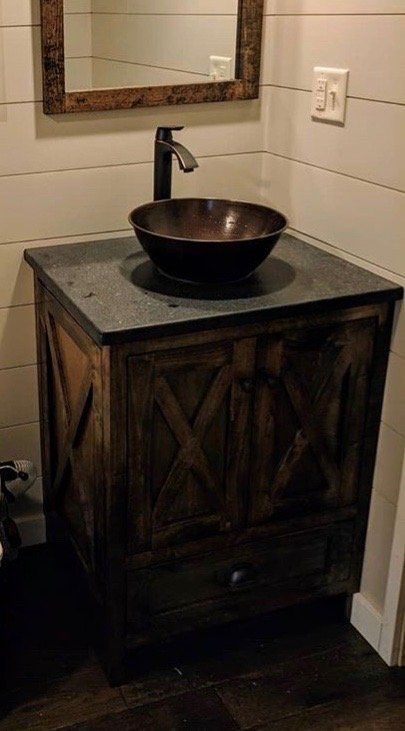
At what (x,y) coordinates should I click in order to perform the action: click on object on the floor. Please return your answer as a coordinate pair (x, y). This screenshot has width=405, height=731. Looking at the image, I should click on (16, 481).